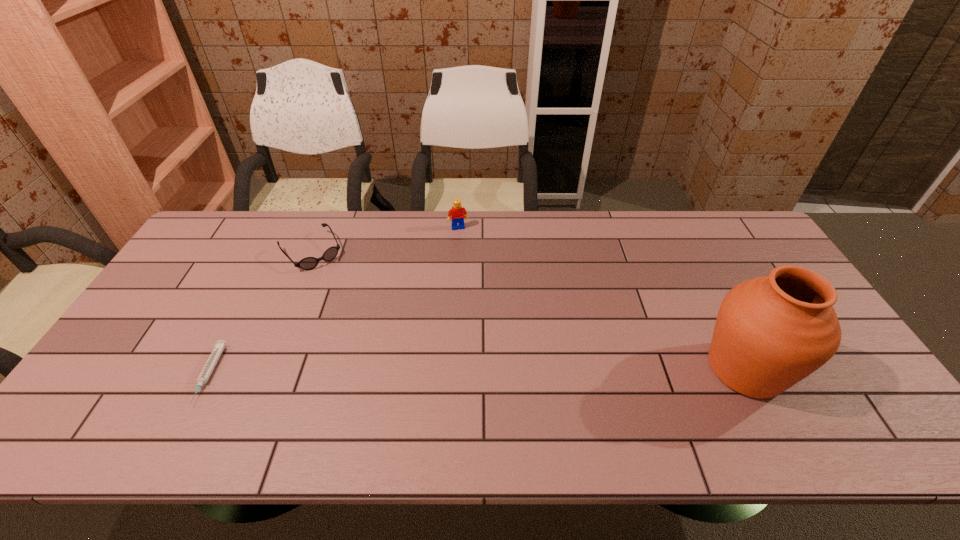
The image size is (960, 540). Identify the location of vacant space located 0.190m on the lenses of the sunglasses. (351, 303).

Identify the location of vacant space situated on the lenses of the sunglasses. (376, 336).

I want to click on vacant space located 0.080m on the front-facing side of the second tallest object, so click(464, 245).

Image resolution: width=960 pixels, height=540 pixels. Identify the location of vacant space located 0.070m on the front-facing side of the second tallest object. (464, 243).

Locate an element on the screen. The height and width of the screenshot is (540, 960). vacant point located on the front-facing side of the second tallest object is located at coordinates (468, 256).

Locate an element on the screen. The width and height of the screenshot is (960, 540). sunglasses that is at the far edge is located at coordinates (308, 263).

This screenshot has width=960, height=540. Identify the location of Lego at the far edge. (457, 213).

Locate an element on the screen. The image size is (960, 540). syringe that is at the near edge is located at coordinates (207, 370).

Identify the location of urn at the near edge. This screenshot has height=540, width=960. (771, 332).

You are a GUI agent. You are given a task and a screenshot of the screen. Output one action in this format:
    pyautogui.click(x=<x>, y=<y>)
    Task: Click on the object at the right edge
    The image size is (960, 540).
    Given the screenshot: What is the action you would take?
    pyautogui.click(x=771, y=332)